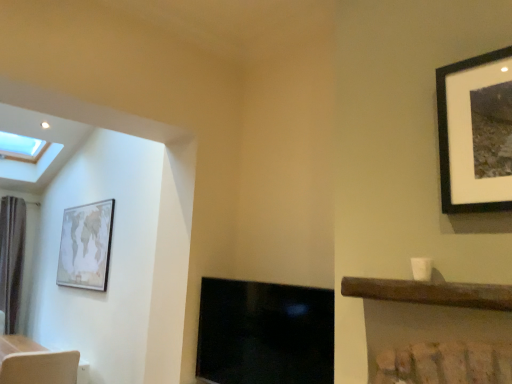
Question: From the image's perspective, does dark brown fabric curtain at left appear lower than light brown textured swivel chair at lower left?

Choices:
 (A) yes
 (B) no

Answer: (B)

Question: Is dark brown fabric curtain at left to the right of light brown textured swivel chair at lower left from the viewer's perspective?

Choices:
 (A) yes
 (B) no

Answer: (B)

Question: Does dark brown fabric curtain at left turn towards light brown textured swivel chair at lower left?

Choices:
 (A) no
 (B) yes

Answer: (B)

Question: Can you confirm if dark brown fabric curtain at left is shorter than light brown textured swivel chair at lower left?

Choices:
 (A) yes
 (B) no

Answer: (B)

Question: From the image's perspective, does dark brown fabric curtain at left appear higher than light brown textured swivel chair at lower left?

Choices:
 (A) yes
 (B) no

Answer: (A)

Question: Does dark brown fabric curtain at left come behind light brown textured swivel chair at lower left?

Choices:
 (A) no
 (B) yes

Answer: (B)

Question: From a real-world perspective, does light brown textured swivel chair at lower left sit lower than black glossy fireplace at center?

Choices:
 (A) yes
 (B) no

Answer: (A)

Question: From the image's perspective, is light brown textured swivel chair at lower left below black glossy fireplace at center?

Choices:
 (A) no
 (B) yes

Answer: (B)

Question: From a real-world perspective, does light brown textured swivel chair at lower left stand above black glossy fireplace at center?

Choices:
 (A) yes
 (B) no

Answer: (B)

Question: Considering the relative sizes of light brown textured swivel chair at lower left and black glossy fireplace at center in the image provided, is light brown textured swivel chair at lower left taller than black glossy fireplace at center?

Choices:
 (A) no
 (B) yes

Answer: (A)

Question: Considering the relative positions of light brown textured swivel chair at lower left and black glossy fireplace at center in the image provided, is light brown textured swivel chair at lower left to the right of black glossy fireplace at center from the viewer's perspective?

Choices:
 (A) no
 (B) yes

Answer: (A)

Question: From the image's perspective, is light brown textured swivel chair at lower left over black glossy fireplace at center?

Choices:
 (A) yes
 (B) no

Answer: (B)

Question: Can you confirm if light brown textured swivel chair at lower left is taller than dark brown fabric curtain at left?

Choices:
 (A) yes
 (B) no

Answer: (B)